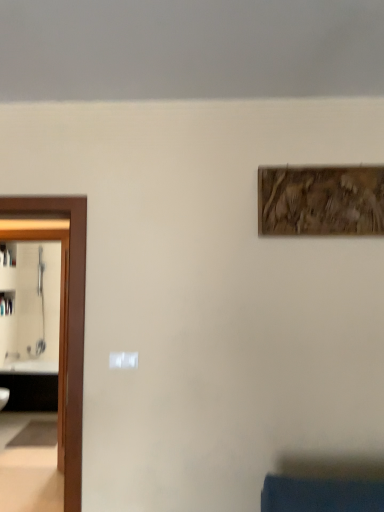
I want to click on white glossy sink at left, so click(31, 385).

What is the approximate width of brown wooden door at left?

brown wooden door at left is 14.15 inches wide.

Image resolution: width=384 pixels, height=512 pixels. Identify the location of wooden textured artwork at upper right. (321, 201).

From a real-world perspective, who is located lower, brown wooden door at left or white glossy sink at left?

white glossy sink at left.

From the image's perspective, between brown wooden door at left and white glossy sink at left, which one is located above?

From the image's view, brown wooden door at left is above.

Locate an element on the screen. sink behind the brown wooden door at left is located at coordinates (31, 385).

Is point (15, 394) closer to viewer compared to point (374, 222)?

No.

Would you say white glossy sink at left is inside or outside wooden textured artwork at upper right?

white glossy sink at left is located beyond the bounds of wooden textured artwork at upper right.

Which of these two, white glossy sink at left or wooden textured artwork at upper right, stands shorter?

With less height is wooden textured artwork at upper right.

From a real-world perspective, is white glossy sink at left located higher than wooden textured artwork at upper right?

No, from a real-world perspective, white glossy sink at left is not on top of wooden textured artwork at upper right.

In the scene shown: Which of these two, wooden textured artwork at upper right or white glossy sink at left, is thinner?

With smaller width is wooden textured artwork at upper right.

Looking at this image, is wooden textured artwork at upper right in front of white glossy sink at left?

Yes, the depth of wooden textured artwork at upper right is less than that of white glossy sink at left.

Could you tell me if wooden textured artwork at upper right is facing white glossy sink at left?

No, wooden textured artwork at upper right is not turned towards white glossy sink at left.

Can you confirm if wooden textured artwork at upper right is taller than white glossy sink at left?

In fact, wooden textured artwork at upper right may be shorter than white glossy sink at left.

Does wooden textured artwork at upper right contain brown wooden door at left?

That's incorrect, brown wooden door at left is not inside wooden textured artwork at upper right.

From a real-world perspective, is wooden textured artwork at upper right on brown wooden door at left?

Yes, from a real-world perspective, wooden textured artwork at upper right is on top of brown wooden door at left.

Which point is more forward, (326, 183) or (33, 205)?

The point (326, 183) is closer to the camera.

Does wooden textured artwork at upper right have a greater height compared to brown wooden door at left?

Incorrect, the height of wooden textured artwork at upper right is not larger of that of brown wooden door at left.

From the picture: Is white glossy sink at left positioned far away from brown wooden door at left?

white glossy sink at left is positioned a significant distance from brown wooden door at left.

From the image's perspective, which is below, white glossy sink at left or brown wooden door at left?

white glossy sink at left appears lower in the image.

Which of these two, white glossy sink at left or brown wooden door at left, is smaller?

Smaller between the two is white glossy sink at left.

Where is `picture frame on the right of brown wooden door at left`? Image resolution: width=384 pixels, height=512 pixels. picture frame on the right of brown wooden door at left is located at coordinates (321, 201).

Is brown wooden door at left positioned with its back to wooden textured artwork at upper right?

No, brown wooden door at left's orientation is not away from wooden textured artwork at upper right.

Is point (70, 422) farther from camera compared to point (307, 223)?

That is True.

From the image's perspective, is brown wooden door at left above or below wooden textured artwork at upper right?

Clearly, from the image's perspective, brown wooden door at left is below wooden textured artwork at upper right.

Locate an element on the screen. elevator in front of the white glossy sink at left is located at coordinates (68, 324).

Image resolution: width=384 pixels, height=512 pixels. I want to click on sink that appears below the wooden textured artwork at upper right (from the image's perspective), so click(31, 385).

Which object lies nearer to the anchor point brown wooden door at left, white glossy sink at left or wooden textured artwork at upper right?

Based on the image, wooden textured artwork at upper right appears to be nearer to brown wooden door at left.

In the scene shown: Considering their positions, is brown wooden door at left positioned further to white glossy sink at left than wooden textured artwork at upper right?

wooden textured artwork at upper right is positioned further to the anchor white glossy sink at left.

From the image, which object appears to be farther from wooden textured artwork at upper right, white glossy sink at left or brown wooden door at left?

The object further to wooden textured artwork at upper right is white glossy sink at left.

Considering their positions, is wooden textured artwork at upper right positioned further to brown wooden door at left than white glossy sink at left?

Among the two, white glossy sink at left is located further to brown wooden door at left.

Based on their spatial positions, is wooden textured artwork at upper right or brown wooden door at left further from white glossy sink at left?

wooden textured artwork at upper right lies further to white glossy sink at left than the other object.

Consider the image. Which object lies nearer to the anchor point wooden textured artwork at upper right, brown wooden door at left or white glossy sink at left?

brown wooden door at left.

Locate an element on the screen. Image resolution: width=384 pixels, height=512 pixels. picture frame between brown wooden door at left and white glossy sink at left along the z-axis is located at coordinates (321, 201).